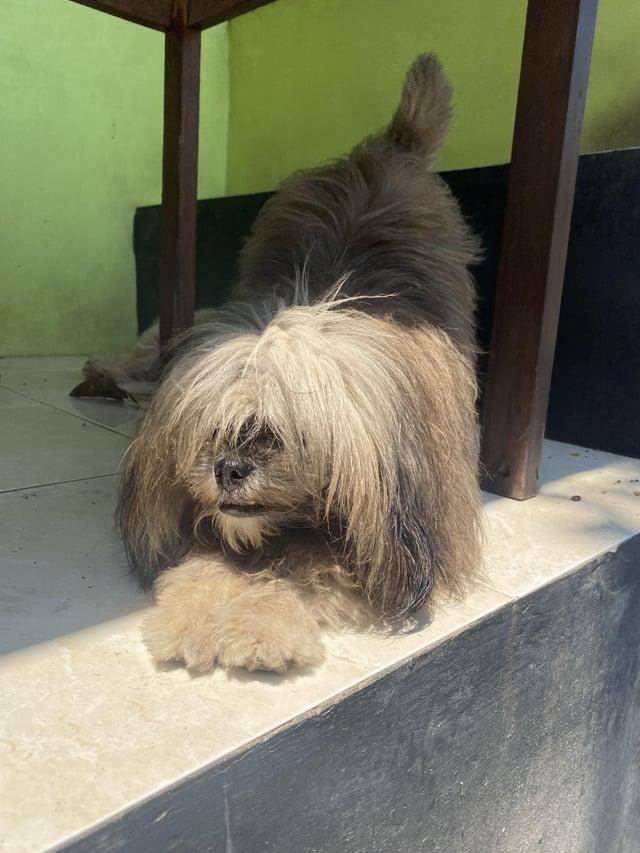
You are a GUI agent. You are given a task and a screenshot of the screen. Output one action in this format:
    pyautogui.click(x=<x>, y=<y>)
    Task: Click on the wall
    The height and width of the screenshot is (853, 640).
    Given the screenshot: What is the action you would take?
    pyautogui.click(x=504, y=24)